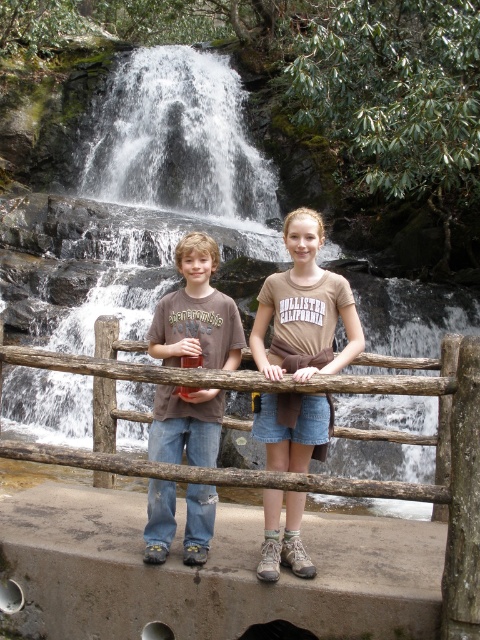
Can you confirm if brown wooden fence at center is positioned below brown cotton shirt at center?

Correct, brown wooden fence at center is located below brown cotton shirt at center.

Does brown wooden fence at center appear over brown cotton shirt at center?

Incorrect, brown wooden fence at center is not positioned above brown cotton shirt at center.

Find the location of a particular element. brown wooden fence at center is located at coordinates (256, 545).

In the scene shown: Can you confirm if brown wooden fence at center is bigger than brown cotton t-shirt at center?

Indeed, brown wooden fence at center has a larger size compared to brown cotton t-shirt at center.

Does point (384, 634) lie in front of point (228, 317)?

Yes.

Which is behind, point (409, 388) or point (195, 509)?

Point (195, 509)

Locate an element on the screen. The width and height of the screenshot is (480, 640). brown wooden fence at center is located at coordinates (256, 545).

Who is lower down, brown cotton shirt at center or brown cotton t-shirt at center?

brown cotton t-shirt at center is below.

Who is higher up, brown cotton shirt at center or brown cotton t-shirt at center?

brown cotton shirt at center is higher up.

Identify the location of brown cotton shirt at center. The width and height of the screenshot is (480, 640). (303, 308).